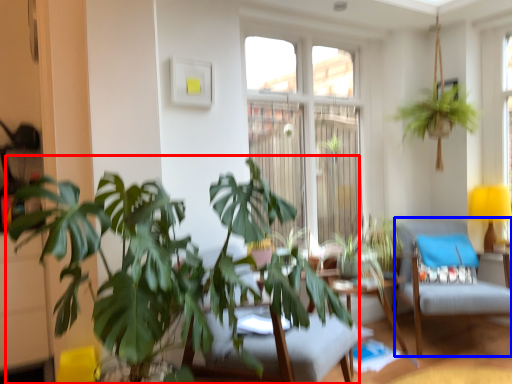
Question: Among these objects, which one is farthest to the camera, houseplant (highlighted by a red box) or swivel chair (highlighted by a blue box)?

Choices:
 (A) houseplant
 (B) swivel chair

Answer: (B)